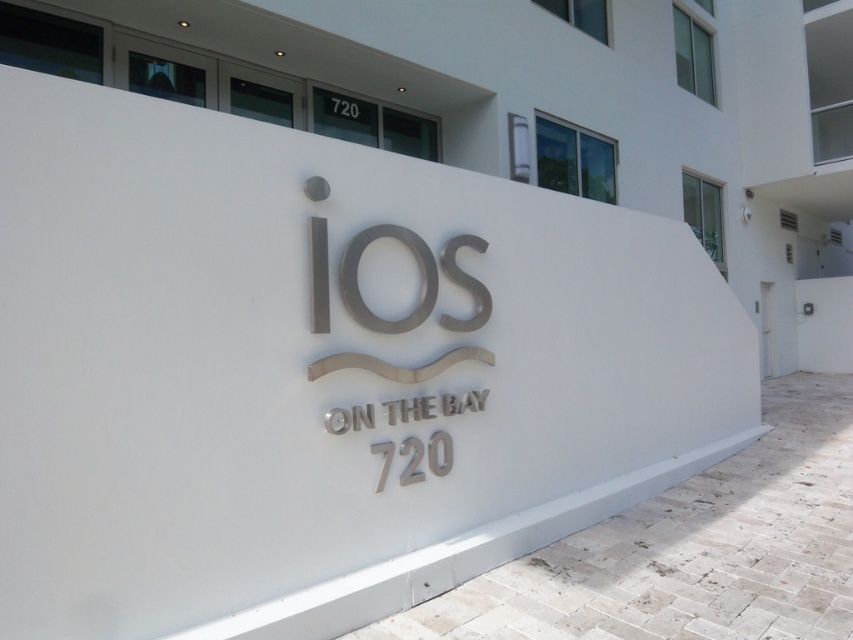
Question: Does satin silver sign at center have a lesser width compared to silver metallic number at center?

Choices:
 (A) no
 (B) yes

Answer: (A)

Question: Which point is closer to the camera?

Choices:
 (A) white metallic number at upper center
 (B) silver metallic number at center
 (C) satin silver sign at center

Answer: (C)

Question: Does satin silver sign at center lie behind silver metallic number at center?

Choices:
 (A) yes
 (B) no

Answer: (B)

Question: Which object is closer to the camera taking this photo?

Choices:
 (A) satin silver sign at center
 (B) silver metallic number at center

Answer: (A)

Question: Is satin silver sign at center thinner than white metallic number at upper center?

Choices:
 (A) yes
 (B) no

Answer: (B)

Question: Among these points, which one is farthest from the camera?

Choices:
 (A) (476, 356)
 (B) (345, 109)

Answer: (B)